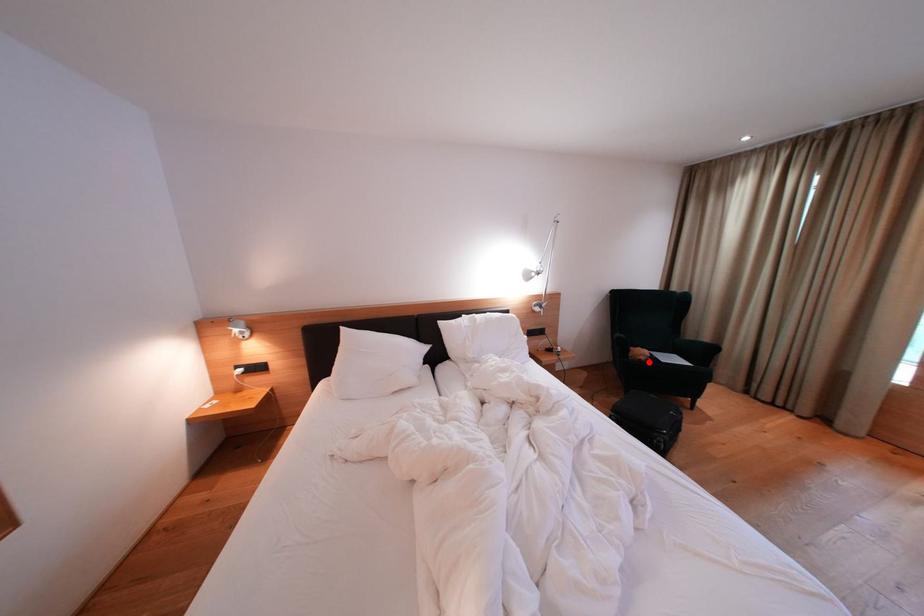
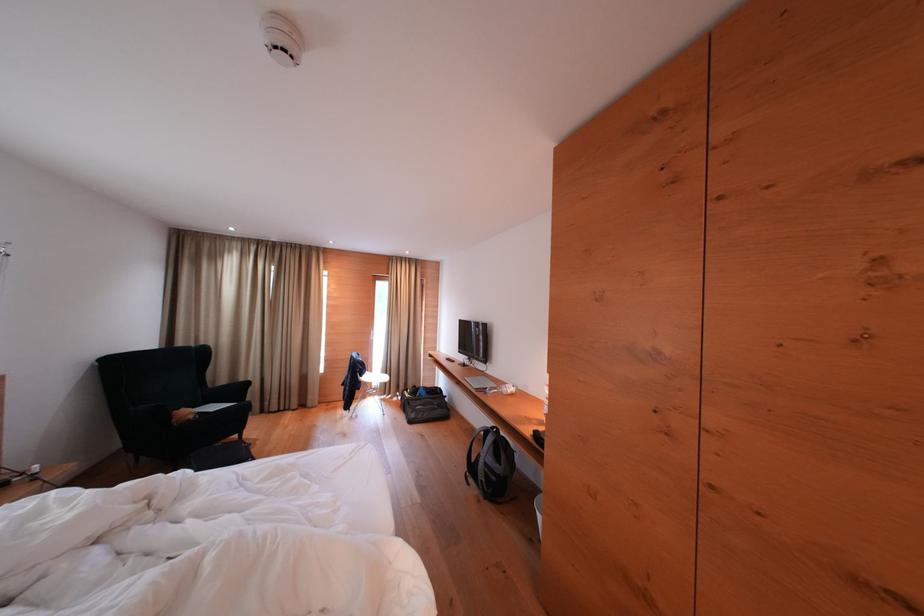
Question: A red point is marked in image1. In image2, is the corresponding 3D point closer to the camera or farther? Reply with the corresponding letter.

Choices:
 (A) The corresponding 3D point is closer.
 (B) The corresponding 3D point is farther.

Answer: (A)